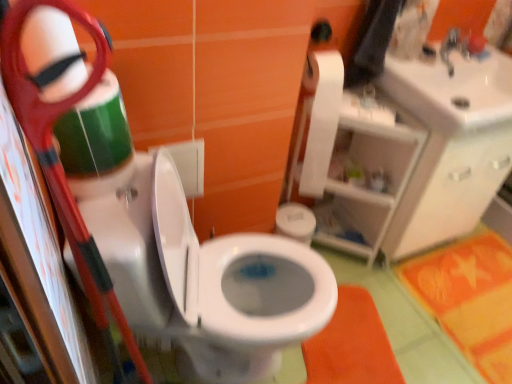
What do you see at coordinates (453, 90) in the screenshot?
I see `white glossy sink at upper right` at bounding box center [453, 90].

The height and width of the screenshot is (384, 512). What do you see at coordinates (352, 345) in the screenshot?
I see `orange fabric bath mat at lower center, which is the first bath mat in left-to-right order` at bounding box center [352, 345].

This screenshot has height=384, width=512. What do you see at coordinates (368, 174) in the screenshot?
I see `white plastic shelf at upper right` at bounding box center [368, 174].

The height and width of the screenshot is (384, 512). Identify the location of white glossy sink at upper right. (453, 90).

Measure the distance from white matte toilet paper at upper right to green plastic scissors at left.

They are 37.13 inches apart.

Considering the sizes of white matte toilet paper at upper right and green plastic scissors at left in the image, is white matte toilet paper at upper right wider or thinner than green plastic scissors at left?

Considering their sizes, white matte toilet paper at upper right looks broader than green plastic scissors at left.

Is white matte toilet paper at upper right to the left of green plastic scissors at left from the viewer's perspective?

No.

Can you tell me how much white matte toilet paper at upper right and green plastic scissors at left differ in facing direction?

They differ by 87.2 degrees in their facing directions.

Considering the sizes of objects white plastic shelf at upper right and white glossy toilet at center in the image provided, who is thinner, white plastic shelf at upper right or white glossy toilet at center?

white plastic shelf at upper right is thinner.

From the picture: Does white plastic shelf at upper right contain white glossy toilet at center?

No, white glossy toilet at center is not a part of white plastic shelf at upper right.

Considering the relative positions of white plastic shelf at upper right and white glossy toilet at center in the image provided, is white plastic shelf at upper right behind white glossy toilet at center?

Yes.

From the image's perspective, which is below, white plastic shelf at upper right or white glossy toilet at center?

white glossy toilet at center.

Does white matte toilet paper at upper right turn towards orange/yellow fabric bath mat at lower right, the 2th bath mat from the left?

No, white matte toilet paper at upper right is not aimed at orange/yellow fabric bath mat at lower right, the 2th bath mat from the left.

From a real-world perspective, who is located higher, white matte toilet paper at upper right or orange/yellow fabric bath mat at lower right, the 2th bath mat from the left?

white matte toilet paper at upper right.

Is white matte toilet paper at upper right far away from orange/yellow fabric bath mat at lower right, the first bath mat positioned from the right?

They are positioned close to each other.

Between white matte toilet paper at upper right and orange/yellow fabric bath mat at lower right, the first bath mat positioned from the right, which one has less height?

Standing shorter between the two is orange/yellow fabric bath mat at lower right, the first bath mat positioned from the right.

Can we say white glossy toilet at center lies outside white matte toilet paper at upper right?

Yes, white glossy toilet at center is located beyond the bounds of white matte toilet paper at upper right.

From a real-world perspective, is white glossy toilet at center physically above white matte toilet paper at upper right?

No.

Does point (175, 313) appear closer or farther from the camera than point (321, 175)?

Point (175, 313) is closer to the camera than point (321, 175).

Is white glossy toilet at center bigger or smaller than white matte toilet paper at upper right?

In the image, white glossy toilet at center appears to be larger than white matte toilet paper at upper right.

Can you confirm if white matte toilet paper at upper right is smaller than white glossy sink at upper right?

Correct, white matte toilet paper at upper right occupies less space than white glossy sink at upper right.

What's the angular difference between white matte toilet paper at upper right and white glossy sink at upper right's facing directions?

The angular difference between white matte toilet paper at upper right and white glossy sink at upper right is 0.849 degrees.

Considering their positions, is white matte toilet paper at upper right located in front of or behind white glossy sink at upper right?

Visually, white matte toilet paper at upper right is located behind white glossy sink at upper right.

Is orange/yellow fabric bath mat at lower right, the 2th bath mat from the left, not near white glossy sink at upper right?

Actually, orange/yellow fabric bath mat at lower right, the 2th bath mat from the left, and white glossy sink at upper right are a little close together.

Could you measure the distance between orange/yellow fabric bath mat at lower right, the 2th bath mat from the left, and white glossy sink at upper right?

A distance of 30.95 inches exists between orange/yellow fabric bath mat at lower right, the 2th bath mat from the left, and white glossy sink at upper right.

There is a white glossy sink at upper right. Find the location of `the 1st bath mat below it (from the image's perspective)`. the 1st bath mat below it (from the image's perspective) is located at coordinates (470, 299).

Is orange/yellow fabric bath mat at lower right, the first bath mat positioned from the right, at the left side of white glossy sink at upper right?

No, orange/yellow fabric bath mat at lower right, the first bath mat positioned from the right, is not to the left of white glossy sink at upper right.

Relative to white plastic shelf at upper right, is white glossy sink at upper right in front or behind?

white glossy sink at upper right is positioned closer to the viewer than white plastic shelf at upper right.

Who is taller, white glossy sink at upper right or white plastic shelf at upper right?

Standing taller between the two is white plastic shelf at upper right.

Is white glossy sink at upper right touching white plastic shelf at upper right?

They are not placed beside each other.

Can you confirm if white glossy sink at upper right is wider than white plastic shelf at upper right?

Yes, white glossy sink at upper right is wider than white plastic shelf at upper right.

Find the location of `toilet paper behind the green plastic scissors at left`. toilet paper behind the green plastic scissors at left is located at coordinates (321, 118).

At what (x,y) coordinates should I click in order to perform the action: click on shelf directly beneath the white glossy toilet at center (from a real-world perspective). Please return your answer as a coordinate pair (x, y). The width and height of the screenshot is (512, 384). Looking at the image, I should click on (368, 174).

Considering their positions, is orange/yellow fabric bath mat at lower right, the 2th bath mat from the left, positioned further to white glossy toilet at center than white matte toilet paper at upper right?

Based on the image, orange/yellow fabric bath mat at lower right, the 2th bath mat from the left, appears to be further to white glossy toilet at center.

Estimate the real-world distances between objects in this image. Which object is closer to green plastic scissors at left, orange fabric bath mat at lower center, which is the first bath mat in left-to-right order, or orange/yellow fabric bath mat at lower right, the first bath mat positioned from the right?

Based on the image, orange fabric bath mat at lower center, which is the first bath mat in left-to-right order, appears to be nearer to green plastic scissors at left.

Based on their spatial positions, is orange fabric bath mat at lower center, which is the first bath mat in left-to-right order, or white plastic shelf at upper right closer to white glossy toilet at center?

orange fabric bath mat at lower center, which is the first bath mat in left-to-right order, is positioned closer to the anchor white glossy toilet at center.

Considering their positions, is white plastic shelf at upper right positioned closer to orange/yellow fabric bath mat at lower right, the first bath mat positioned from the right, than green plastic scissors at left?

The object closer to orange/yellow fabric bath mat at lower right, the first bath mat positioned from the right, is white plastic shelf at upper right.

Which object lies further to the anchor point orange/yellow fabric bath mat at lower right, the 2th bath mat from the left, white matte toilet paper at upper right or green plastic scissors at left?

→ green plastic scissors at left is further to orange/yellow fabric bath mat at lower right, the 2th bath mat from the left.

Which object lies further to the anchor point white plastic shelf at upper right, green plastic scissors at left or orange fabric bath mat at lower center, the second bath mat viewed from the right?

green plastic scissors at left.

In the scene shown: Looking at the image, which one is located further to orange/yellow fabric bath mat at lower right, the 2th bath mat from the left, orange fabric bath mat at lower center, which is the first bath mat in left-to-right order, or white glossy sink at upper right?

white glossy sink at upper right lies further to orange/yellow fabric bath mat at lower right, the 2th bath mat from the left, than the other object.

When comparing their distances from orange fabric bath mat at lower center, which is the first bath mat in left-to-right order, does white plastic shelf at upper right or white glossy sink at upper right seem further?

Among the two, white glossy sink at upper right is located further to orange fabric bath mat at lower center, which is the first bath mat in left-to-right order.

This screenshot has width=512, height=384. I want to click on toilet between green plastic scissors at left and white plastic shelf at upper right along the z-axis, so (202, 276).

Find the location of a particular element. The image size is (512, 384). shelf between orange fabric bath mat at lower center, the second bath mat viewed from the right, and orange/yellow fabric bath mat at lower right, the first bath mat positioned from the right, in the horizontal direction is located at coordinates (368, 174).

The width and height of the screenshot is (512, 384). Find the location of `toilet between green plastic scissors at left and orange fabric bath mat at lower center, the second bath mat viewed from the right, in the front-back direction`. toilet between green plastic scissors at left and orange fabric bath mat at lower center, the second bath mat viewed from the right, in the front-back direction is located at coordinates (202, 276).

Where is `shelf between green plastic scissors at left and orange fabric bath mat at lower center, the second bath mat viewed from the right, from front to back`? The image size is (512, 384). shelf between green plastic scissors at left and orange fabric bath mat at lower center, the second bath mat viewed from the right, from front to back is located at coordinates (368, 174).